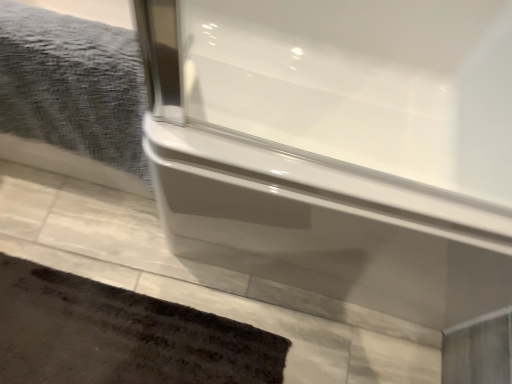
Question: Does gray textured towel at upper left come in front of dark brown textured bath mat at lower left?

Choices:
 (A) yes
 (B) no

Answer: (A)

Question: From a real-world perspective, is gray textured towel at upper left under dark brown textured bath mat at lower left?

Choices:
 (A) yes
 (B) no

Answer: (B)

Question: Is gray textured towel at upper left smaller than dark brown textured bath mat at lower left?

Choices:
 (A) yes
 (B) no

Answer: (B)

Question: Is gray textured towel at upper left facing away from dark brown textured bath mat at lower left?

Choices:
 (A) no
 (B) yes

Answer: (A)

Question: Can you confirm if gray textured towel at upper left is positioned to the right of dark brown textured bath mat at lower left?

Choices:
 (A) no
 (B) yes

Answer: (A)

Question: Is gray textured towel at upper left not close to dark brown textured bath mat at lower left?

Choices:
 (A) no
 (B) yes

Answer: (A)

Question: Is dark brown textured bath mat at lower left to the left of gray textured towel at upper left from the viewer's perspective?

Choices:
 (A) yes
 (B) no

Answer: (B)

Question: Considering the relative sizes of dark brown textured bath mat at lower left and gray textured towel at upper left in the image provided, is dark brown textured bath mat at lower left wider than gray textured towel at upper left?

Choices:
 (A) no
 (B) yes

Answer: (B)

Question: Could you tell me if dark brown textured bath mat at lower left is turned towards gray textured towel at upper left?

Choices:
 (A) no
 (B) yes

Answer: (A)

Question: Can you confirm if dark brown textured bath mat at lower left is positioned to the right of gray textured towel at upper left?

Choices:
 (A) no
 (B) yes

Answer: (B)

Question: Is dark brown textured bath mat at lower left next to gray textured towel at upper left?

Choices:
 (A) yes
 (B) no

Answer: (B)

Question: Is dark brown textured bath mat at lower left positioned with its back to gray textured towel at upper left?

Choices:
 (A) no
 (B) yes

Answer: (A)

Question: From their relative heights in the image, would you say gray textured towel at upper left is taller or shorter than dark brown textured bath mat at lower left?

Choices:
 (A) short
 (B) tall

Answer: (B)